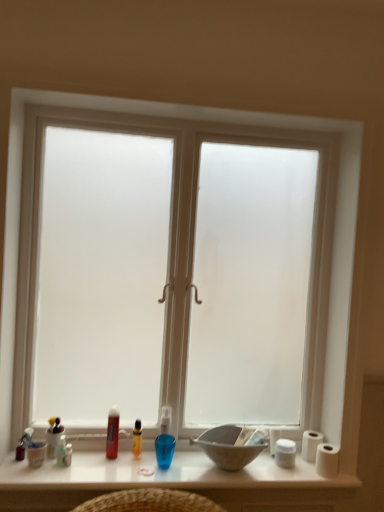
Identify the location of free point to the right of translucent plastic tube at lower center, the fourth toiletry viewed from the left. The height and width of the screenshot is (512, 384). (140, 461).